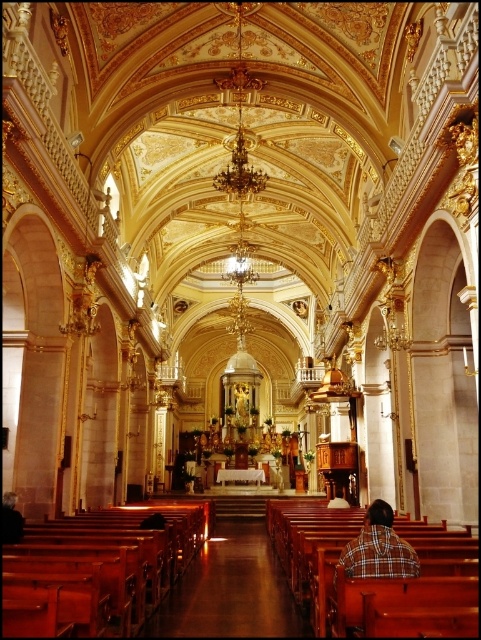
At what (x,y) coordinates should I click in order to perform the action: click on plaid shirt at center. Please return your answer as a coordinate pair (x, y). This screenshot has width=481, height=640. Looking at the image, I should click on (379, 548).

Based on the photo, is plaid shirt at center positioned at the back of wooden bench at center?

No, it is not.

The height and width of the screenshot is (640, 481). I want to click on plaid shirt at center, so click(x=379, y=548).

The height and width of the screenshot is (640, 481). What are the coordinates of `plaid shirt at center` in the screenshot? It's located at (379, 548).